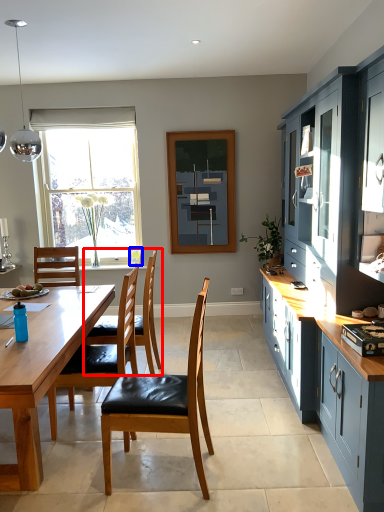
Question: Which object is further to the camera taking this photo, chair (highlighted by a red box) or picture frame (highlighted by a blue box)?

Choices:
 (A) chair
 (B) picture frame

Answer: (B)